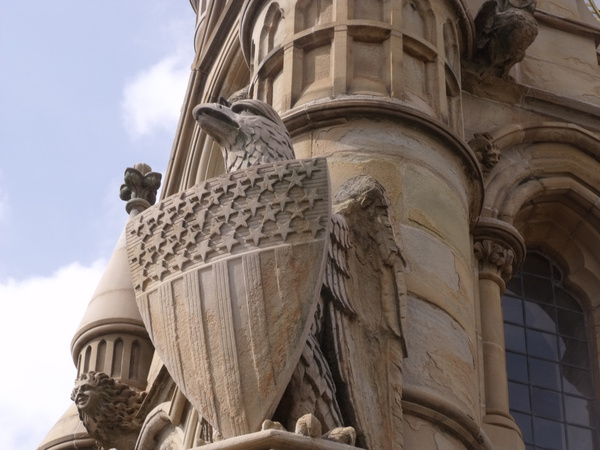
This screenshot has width=600, height=450. In order to click on 1 right window in this screenshot , I will do [x=396, y=329].